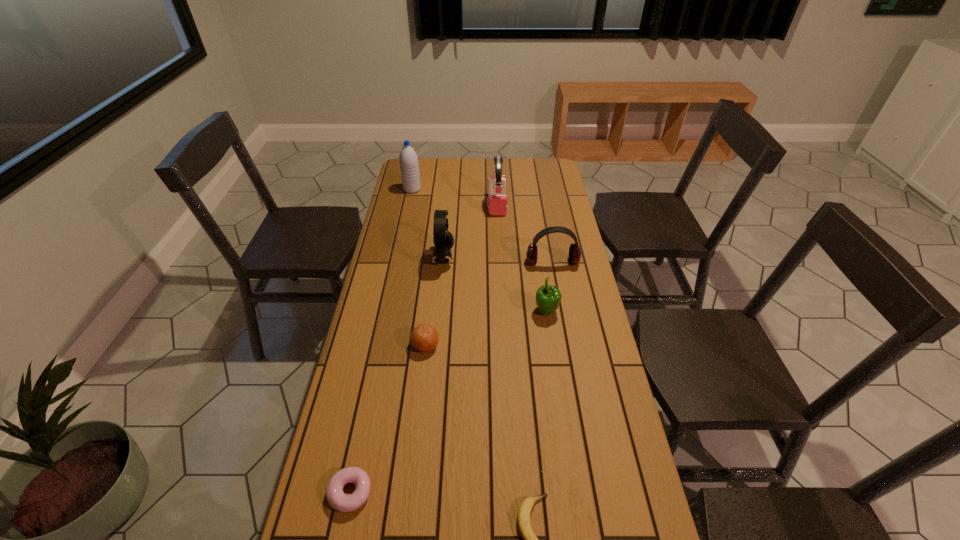
The height and width of the screenshot is (540, 960). Find the location of `water bottle`. water bottle is located at coordinates [x=408, y=160].

This screenshot has width=960, height=540. In order to click on the second earphone from right to left in this screenshot , I will do `click(497, 201)`.

Where is `the leftmost earphone`? This screenshot has height=540, width=960. the leftmost earphone is located at coordinates (443, 240).

This screenshot has width=960, height=540. What are the coordinates of `the fourth tallest object` in the screenshot? It's located at (574, 251).

Locate an element on the screen. The image size is (960, 540). the shortest earphone is located at coordinates (574, 251).

The image size is (960, 540). In order to click on the fifth farthest object in this screenshot , I will do `click(548, 297)`.

The height and width of the screenshot is (540, 960). What are the coordinates of `the fourth shortest object` in the screenshot? It's located at (548, 297).

Locate an element on the screen. The image size is (960, 540). the sixth farthest object is located at coordinates (424, 338).

Find the location of a particular element. This screenshot has width=960, height=540. clementine is located at coordinates (424, 338).

The image size is (960, 540). Find the location of `the second shortest object`. the second shortest object is located at coordinates [x=337, y=499].